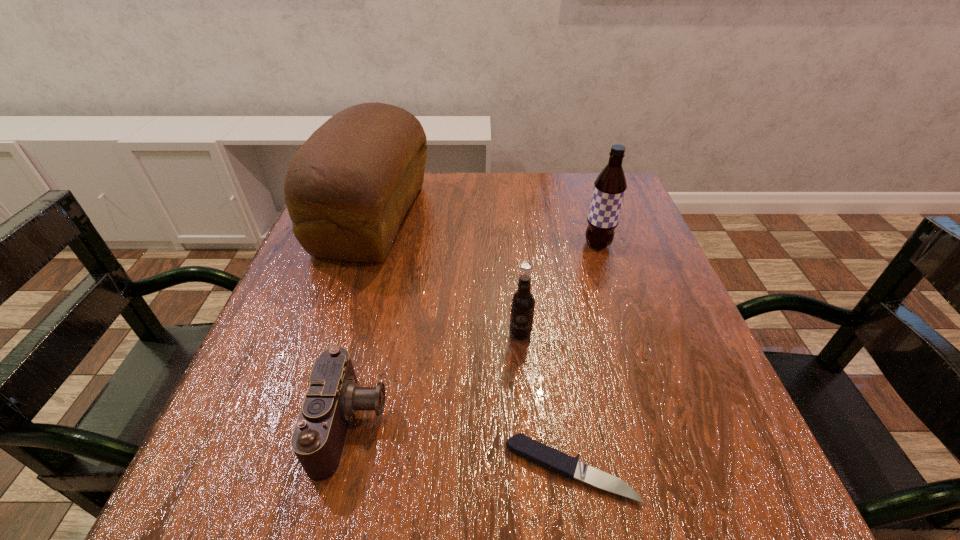
Locate an element on the screen. vacant space that's between the camera and the third shortest object is located at coordinates (436, 379).

This screenshot has height=540, width=960. I want to click on free space between the bread and the nearer root beer, so click(x=446, y=275).

Find the location of a particular element. Image resolution: width=960 pixels, height=540 pixels. vacant space in between the shortest object and the bread is located at coordinates (471, 344).

You are a GUI agent. You are given a task and a screenshot of the screen. Output one action in this format:
    pyautogui.click(x=<x>, y=<y>)
    Task: Click on the vacant space that's between the bread and the rightmost object
    This screenshot has height=540, width=960.
    Given the screenshot: What is the action you would take?
    pyautogui.click(x=485, y=231)

Where is `free point between the camera and the farther root beer`? The image size is (960, 540). free point between the camera and the farther root beer is located at coordinates (474, 334).

Locate which object is the fourth closest to the second shortest object. Please provide its 2D coordinates. Your answer should be formatted as a tuple, i.e. [(x, y)], where the tuple contains the x and y coordinates of a point satisfying the conditions above.

[(609, 187)]

Identify the location of object identified as the closest to the fourth tallest object. The width and height of the screenshot is (960, 540). (534, 451).

Locate an element on the screen. vacant space that satisfies the following two spatial constraints: 1. on the label of the steak knife; 2. on the left side of the third shortest object is located at coordinates (532, 470).

In order to click on free space that satisfies the following two spatial constraints: 1. on the front side of the taller root beer; 2. on the right side of the bread in this screenshot , I will do `click(364, 245)`.

In order to click on vacant area in the image that satisfies the following two spatial constraints: 1. on the front side of the rightmost object; 2. on the front-facing side of the camera in this screenshot , I will do `click(655, 423)`.